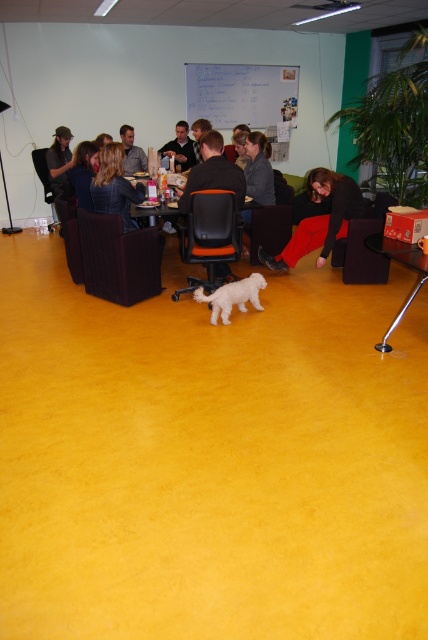
You are a service robot in the room. You need to move from the black leather chair at left to the matte black shirt at left. Is the distance between them sufficient for you to navigate comfortably if your robot is 0.5 meters wide?

The distance between the black leather chair at left and the matte black shirt at left is 1.36 meters. Since your robot is 0.5 meters wide, there is enough space to navigate comfortably as 1.36 meters is greater than 0.5 meters.

You are standing in the room and see the matte black jacket at lower center and the matte gray shirt at center. Which object is positioned to the right of the other?

The matte black jacket at lower center is to the right of the matte gray shirt at center.

You are standing in the center of the room and want to sit down. Which object, the black leather chair at left or the white fluffy dog in the center, is closer to you?

The white fluffy dog in the center is closer to you since you are standing in the center of the room, and the black leather chair at left is located at point (70, 234) which is further away from the center.